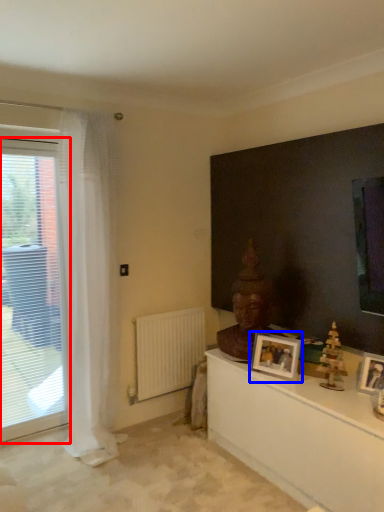
Question: Which of the following is the farthest to the observer, window (highlighted by a red box) or picture frame (highlighted by a blue box)?

Choices:
 (A) window
 (B) picture frame

Answer: (A)